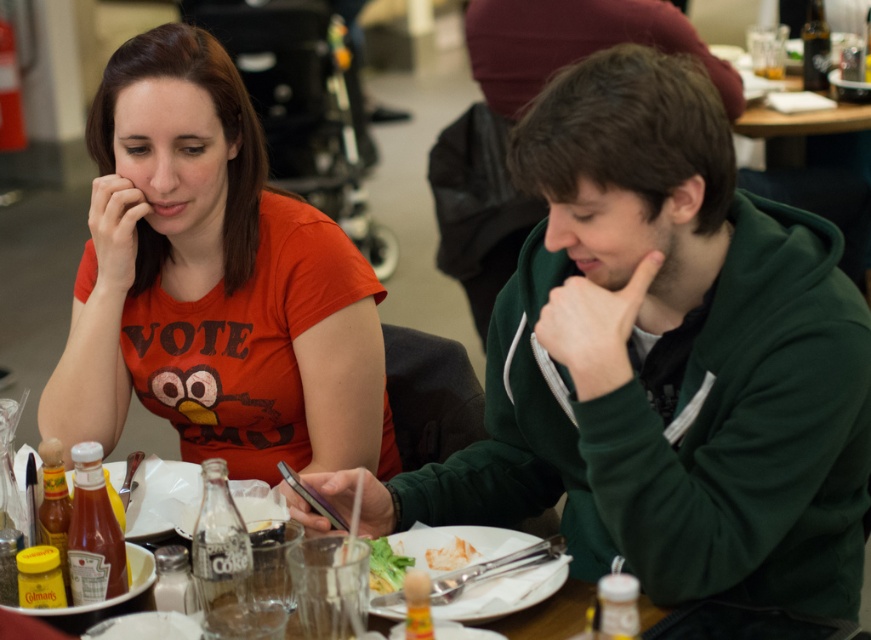
Does green fleece jacket at center appear over wooden table at center?

Indeed, green fleece jacket at center is positioned over wooden table at center.

Is green fleece jacket at center closer to camera compared to wooden table at center?

No, it is not.

You are a GUI agent. You are given a task and a screenshot of the screen. Output one action in this format:
    pyautogui.click(x=<x>, y=<y>)
    Task: Click on the green fleece jacket at center
    The width and height of the screenshot is (871, 640).
    Given the screenshot: What is the action you would take?
    pyautogui.click(x=667, y=358)

The height and width of the screenshot is (640, 871). In order to click on green fleece jacket at center in this screenshot , I will do click(x=667, y=358).

Does point (159, 323) come closer to viewer compared to point (436, 548)?

No, it is behind (436, 548).

What do you see at coordinates (213, 284) in the screenshot?
I see `matte orange t-shirt at upper left` at bounding box center [213, 284].

This screenshot has height=640, width=871. Describe the element at coordinates (213, 284) in the screenshot. I see `matte orange t-shirt at upper left` at that location.

At what (x,y) coordinates should I click in order to perform the action: click on matte orange t-shirt at upper left. Please return your answer as a coordinate pair (x, y). The image size is (871, 640). Looking at the image, I should click on (213, 284).

Does green fleece jacket at center have a lesser width compared to matte orange t-shirt at upper left?

In fact, green fleece jacket at center might be wider than matte orange t-shirt at upper left.

Between green fleece jacket at center and matte orange t-shirt at upper left, which one has more height?

Standing taller between the two is matte orange t-shirt at upper left.

Between point (754, 244) and point (201, 285), which one is positioned behind?

Positioned behind is point (201, 285).

Locate an element on the screen. green fleece jacket at center is located at coordinates (667, 358).